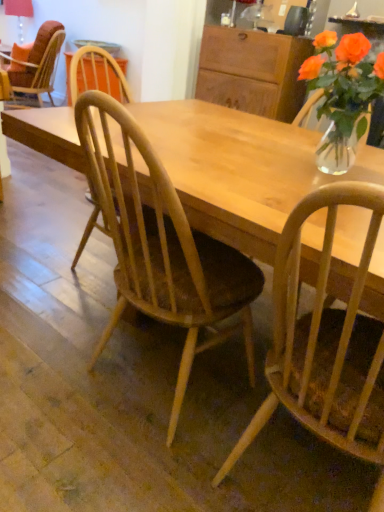
Question: Relative to matte orange fabric chair at upper left, placed as the first chair when sorted from top to bottom, is wooden cabinet at upper center in front or behind?

Choices:
 (A) front
 (B) behind

Answer: (A)

Question: Is wooden cabinet at upper center taller or shorter than matte orange fabric chair at upper left, acting as the third chair starting from the bottom?

Choices:
 (A) short
 (B) tall

Answer: (A)

Question: Considering the real-world distances, which object is closest to the light wood chair at center, acting as the second chair starting from the back?

Choices:
 (A) natural wood chair at center, placed as the 3th chair when sorted from left to right
 (B) matte orange fabric chair at upper left, acting as the third chair starting from the bottom
 (C) translucent glass vase at upper right
 (D) wooden cabinet at upper center

Answer: (A)

Question: Considering the real-world distances, which object is closest to the matte orange fabric chair at upper left, positioned as the third chair in right-to-left order?

Choices:
 (A) natural wood chair at center, placed as the third chair when sorted from back to front
 (B) light wood chair at center, acting as the second chair starting from the back
 (C) wooden cabinet at upper center
 (D) translucent glass vase at upper right

Answer: (C)